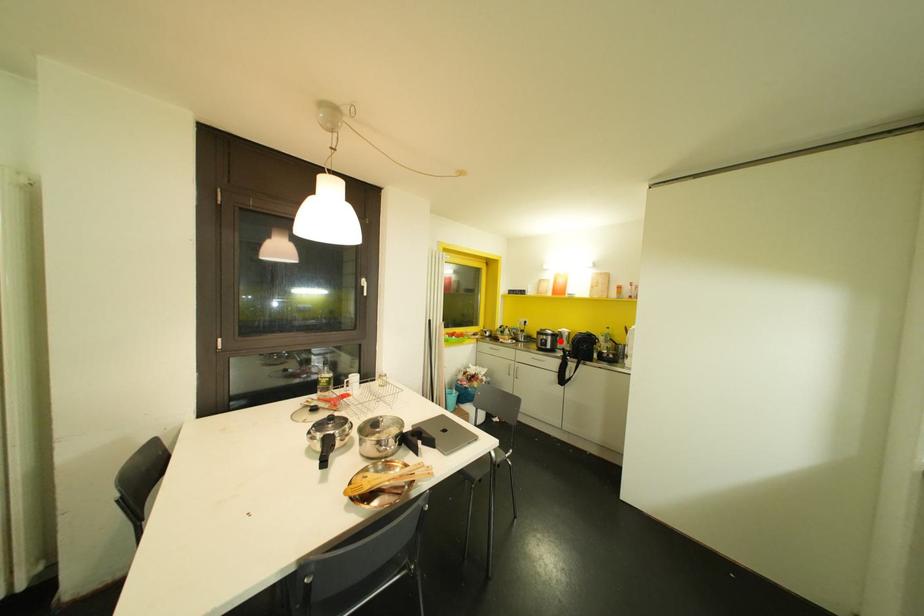
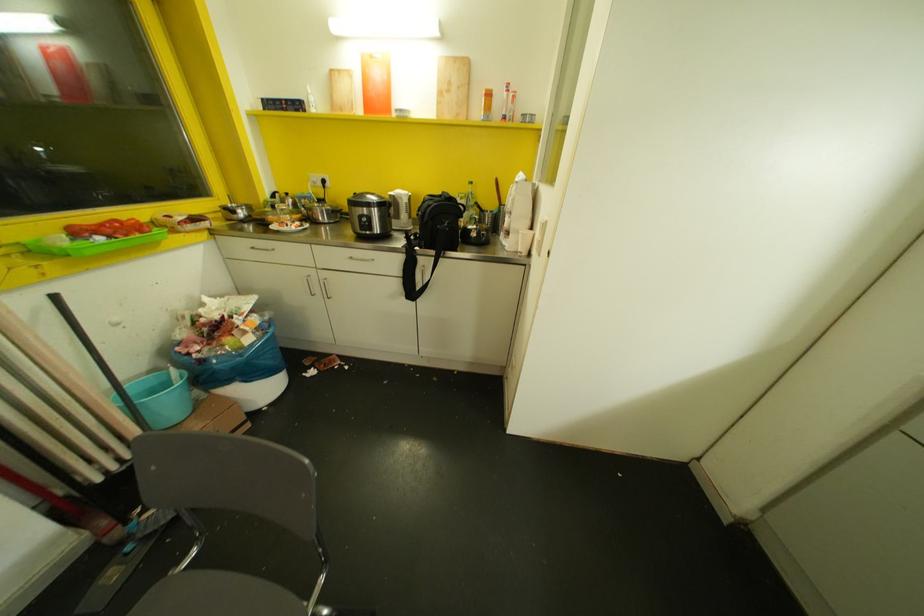
Where in the second image is the point corresponding to the highlighted location from the first image?

(396, 216)